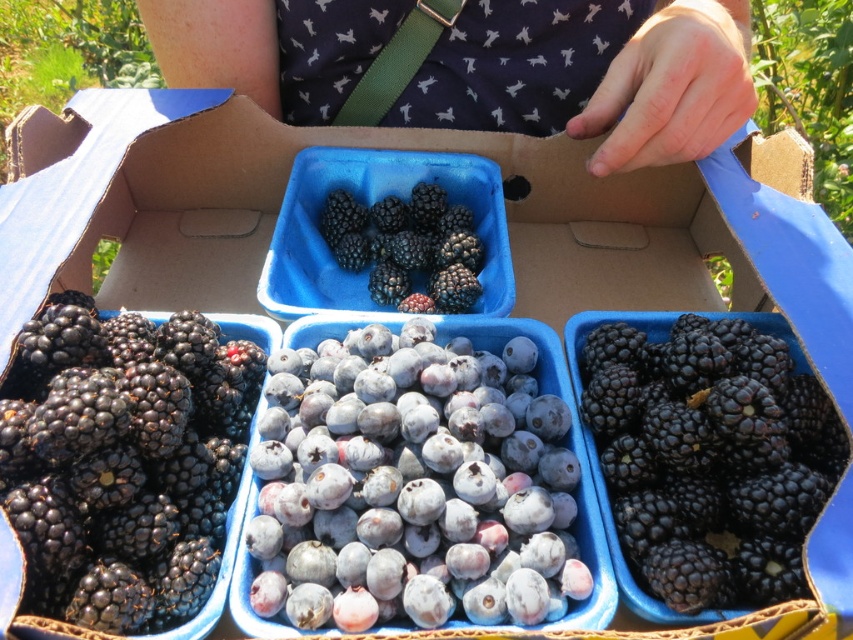
This screenshot has height=640, width=853. What do you see at coordinates (426, 468) in the screenshot? I see `blue matte blueberries at center` at bounding box center [426, 468].

Between blue matte blueberries at center and shiny blackberries at right, which one is positioned lower?

shiny blackberries at right is lower down.

Is point (486, 476) farther from camera compared to point (688, 611)?

That is True.

What are the coordinates of `blue matte blueberries at center` in the screenshot? It's located at [426, 468].

Is blue matte blueberries at center positioned at the back of blue dotted shirt at center?

No, it is in front of blue dotted shirt at center.

Which is more to the left, blue matte blueberries at center or blue dotted shirt at center?

From the viewer's perspective, blue matte blueberries at center appears more on the left side.

What do you see at coordinates (426, 468) in the screenshot?
I see `blue matte blueberries at center` at bounding box center [426, 468].

The height and width of the screenshot is (640, 853). Identify the location of blue matte blueberries at center. (426, 468).

Is the position of shiny black berries at lower left more distant than that of shiny blackberries at center?

No.

Locate an element on the screen. This screenshot has height=640, width=853. shiny black berries at lower left is located at coordinates (125, 461).

You are a GUI agent. You are given a task and a screenshot of the screen. Output one action in this format:
    pyautogui.click(x=<x>, y=<y>)
    Task: Click on the shiny black berries at lower left
    This screenshot has width=853, height=640.
    Given the screenshot: What is the action you would take?
    pyautogui.click(x=125, y=461)